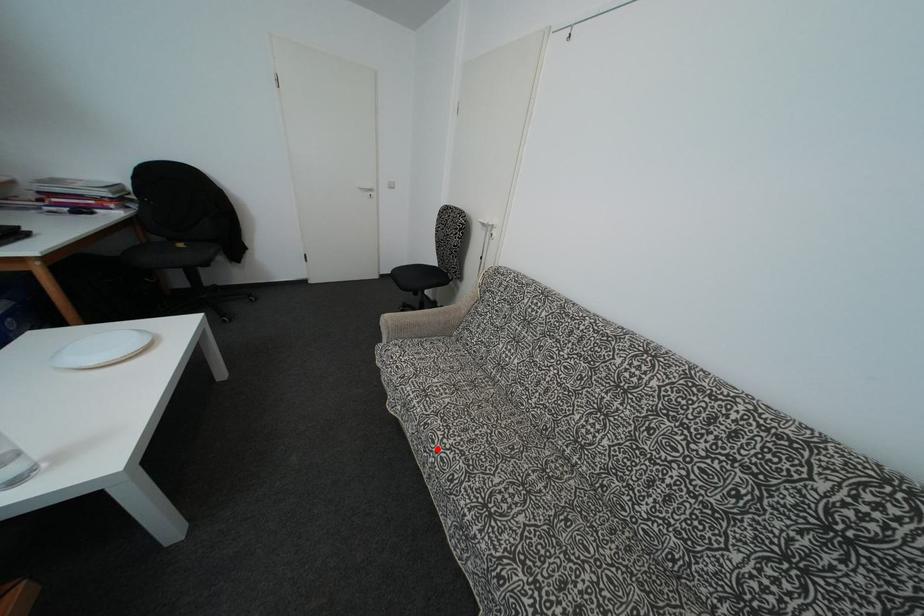
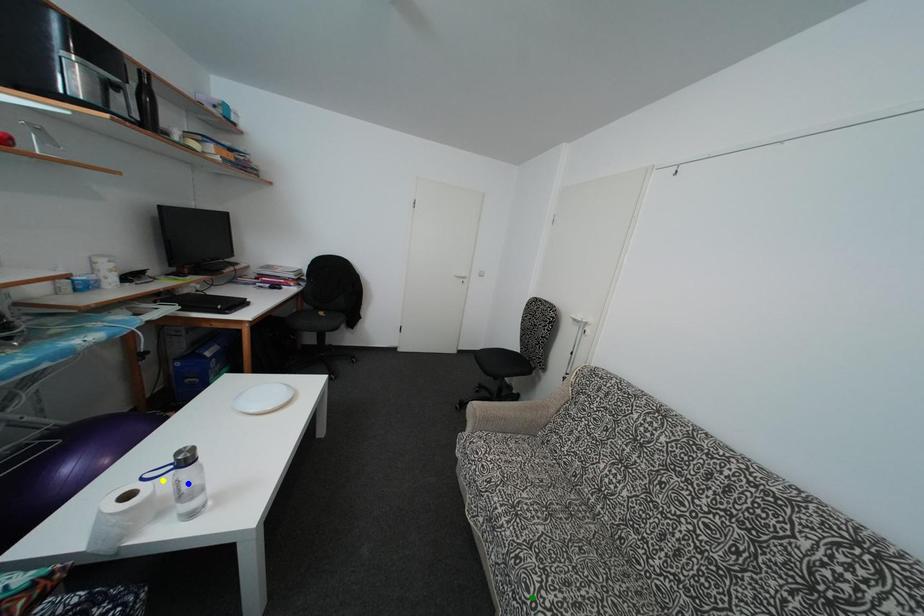
Question: I am providing you with two images of the same scene from different viewpoints. A red point is marked on the first image. You are given multiple points on the second image. Which point in image 2 is actually the same real-world point as the red point in image 1?

Choices:
 (A) blue point
 (B) yellow point
 (C) green point

Answer: (C)